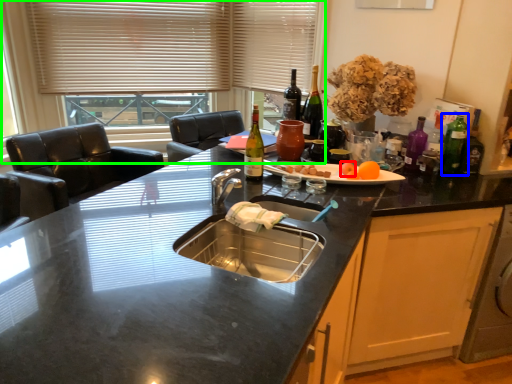
Question: Considering the real-world distances, which object is farthest from food (highlighted by a red box)? bottle (highlighted by a blue box) or window (highlighted by a green box)?

Choices:
 (A) bottle
 (B) window

Answer: (B)